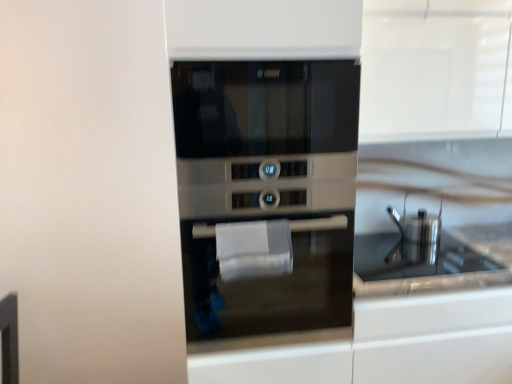
Question: Considering the relative sizes of satin silver oven at center and satin silver oven at center in the image provided, is satin silver oven at center thinner than satin silver oven at center?

Choices:
 (A) yes
 (B) no

Answer: (B)

Question: Can you confirm if satin silver oven at center is wider than satin silver oven at center?

Choices:
 (A) yes
 (B) no

Answer: (A)

Question: Could you tell me if satin silver oven at center is turned towards satin silver oven at center?

Choices:
 (A) no
 (B) yes

Answer: (A)

Question: Could satin silver oven at center be considered to be inside satin silver oven at center?

Choices:
 (A) yes
 (B) no

Answer: (B)

Question: Does satin silver oven at center have a lesser height compared to satin silver oven at center?

Choices:
 (A) no
 (B) yes

Answer: (A)

Question: From the image's perspective, does satin silver oven at center appear lower than satin silver oven at center?

Choices:
 (A) yes
 (B) no

Answer: (B)

Question: From a real-world perspective, is white textured hand towel at center beneath satin silver oven at center?

Choices:
 (A) yes
 (B) no

Answer: (B)

Question: From the image's perspective, would you say white textured hand towel at center is shown under satin silver oven at center?

Choices:
 (A) no
 (B) yes

Answer: (B)

Question: Could you tell me if white textured hand towel at center is facing satin silver oven at center?

Choices:
 (A) no
 (B) yes

Answer: (A)

Question: Can you confirm if white textured hand towel at center is thinner than satin silver oven at center?

Choices:
 (A) no
 (B) yes

Answer: (B)

Question: Would you say satin silver oven at center is part of white textured hand towel at center's contents?

Choices:
 (A) yes
 (B) no

Answer: (B)

Question: From a real-world perspective, is white textured hand towel at center physically above satin silver oven at center?

Choices:
 (A) yes
 (B) no

Answer: (A)

Question: Is satin silver oven at center shorter than satin silver oven at center?

Choices:
 (A) no
 (B) yes

Answer: (B)